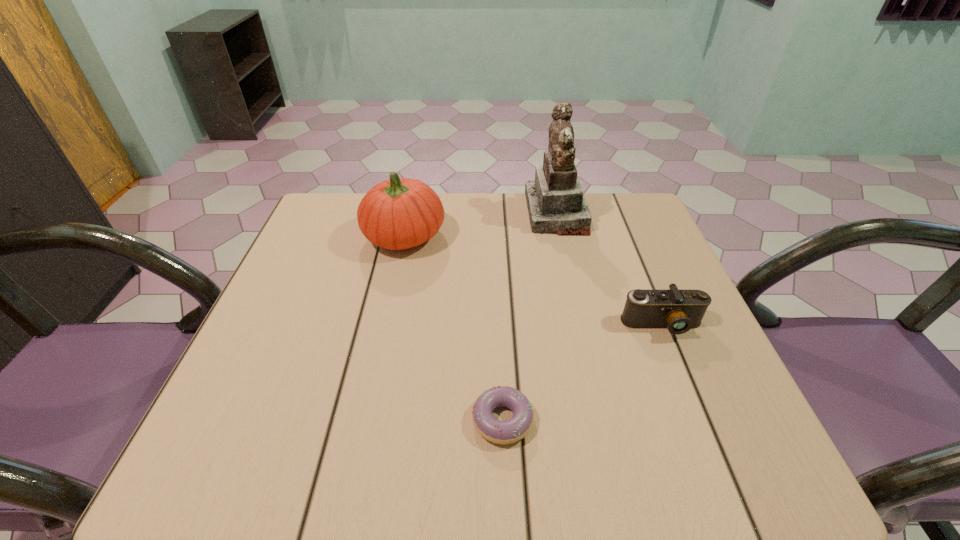
In order to click on free space located on the front-facing side of the tallest object in this screenshot , I will do `click(401, 213)`.

Identify the location of free space located on the right of the pumpkin. (523, 236).

Locate an element on the screen. The image size is (960, 540). vacant region located on the lens of the second nearest object is located at coordinates (680, 368).

Locate an element on the screen. The width and height of the screenshot is (960, 540). vacant space positioned 0.090m on the right of the nearest object is located at coordinates pos(586,420).

Where is `figurine at the far edge`? The height and width of the screenshot is (540, 960). figurine at the far edge is located at coordinates (556, 205).

At what (x,y) coordinates should I click in order to perform the action: click on pumpkin that is at the far edge. Please return your answer as a coordinate pair (x, y). Looking at the image, I should click on (398, 213).

Find the location of `object at the near edge`. object at the near edge is located at coordinates (500, 432).

The image size is (960, 540). What are the coordinates of `object at the left edge` in the screenshot? It's located at (398, 213).

Where is `object at the right edge`? This screenshot has width=960, height=540. object at the right edge is located at coordinates (677, 310).

Find the location of a particular element. This screenshot has width=960, height=540. object located at the far left corner is located at coordinates (398, 213).